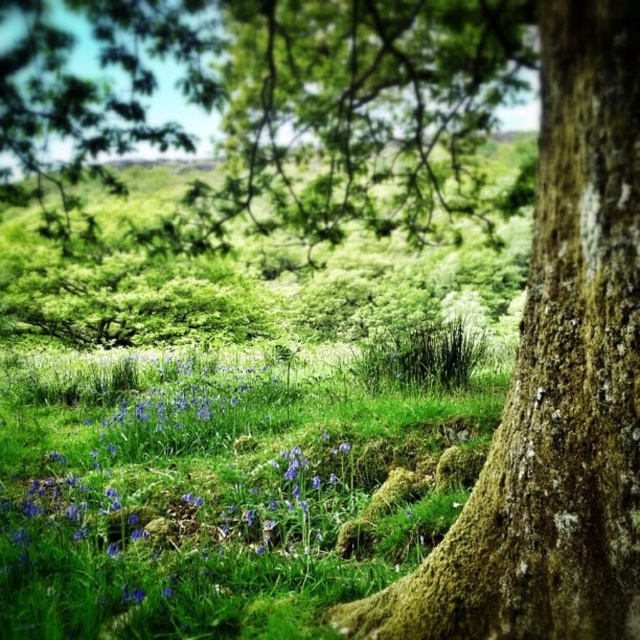
You are a hiker trying to cross the woodland scene. You see the green grassy patch at center and the green mossy tree at center. Which path should you choose if you want to walk on the wider area?

The green grassy patch at center is wider than the green mossy tree at center, so you should choose the green grassy patch at center to walk on the wider area.